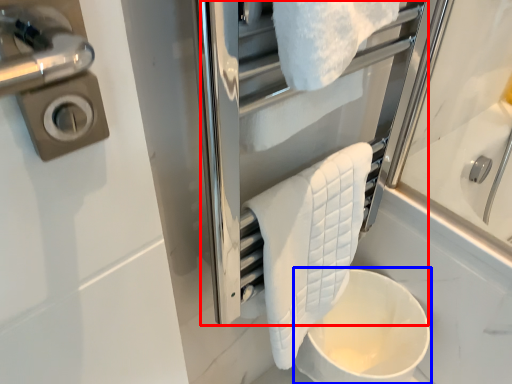
Question: Which of the following is the farthest to the observer, screen door (highlighted by a red box) or toilet bowl (highlighted by a blue box)?

Choices:
 (A) screen door
 (B) toilet bowl

Answer: (B)